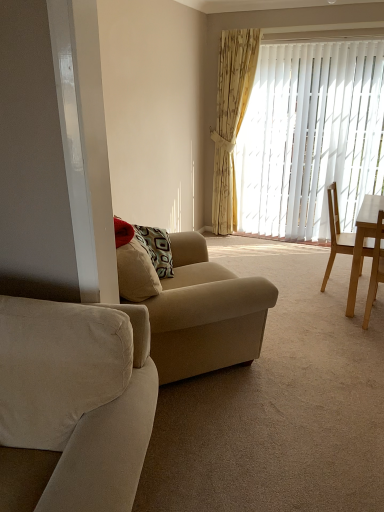
Question: From a real-world perspective, is beige fabric couch at center, placed as the 2th studio couch when sorted from front to back, located higher than yellow floral fabric curtain at upper right?

Choices:
 (A) no
 (B) yes

Answer: (A)

Question: Does beige fabric couch at center, acting as the first studio couch starting from the back, have a greater width compared to yellow floral fabric curtain at upper right?

Choices:
 (A) yes
 (B) no

Answer: (A)

Question: Considering the relative sizes of beige fabric couch at center, placed as the 2th studio couch when sorted from front to back, and yellow floral fabric curtain at upper right in the image provided, is beige fabric couch at center, placed as the 2th studio couch when sorted from front to back, thinner than yellow floral fabric curtain at upper right?

Choices:
 (A) no
 (B) yes

Answer: (A)

Question: Does beige fabric couch at center, placed as the 2th studio couch when sorted from front to back, appear on the left side of yellow floral fabric curtain at upper right?

Choices:
 (A) yes
 (B) no

Answer: (A)

Question: Is beige fabric couch at center, acting as the first studio couch starting from the back, positioned in front of yellow floral fabric curtain at upper right?

Choices:
 (A) yes
 (B) no

Answer: (A)

Question: Is beige fabric couch at center, acting as the first studio couch starting from the back, far from yellow floral fabric curtain at upper right?

Choices:
 (A) no
 (B) yes

Answer: (B)

Question: Can you confirm if suede beige couch at left, positioned as the 1th studio couch in front-to-back order, is positioned to the left of white vertical blinds at center?

Choices:
 (A) no
 (B) yes

Answer: (B)

Question: Could you tell me if suede beige couch at left, positioned as the 1th studio couch in front-to-back order, is turned towards white vertical blinds at center?

Choices:
 (A) no
 (B) yes

Answer: (A)

Question: Is the depth of suede beige couch at left, positioned as the 1th studio couch in front-to-back order, greater than that of white vertical blinds at center?

Choices:
 (A) no
 (B) yes

Answer: (A)

Question: From a real-world perspective, is suede beige couch at left, which is the 2th studio couch from back to front, located beneath white vertical blinds at center?

Choices:
 (A) yes
 (B) no

Answer: (A)

Question: Does suede beige couch at left, positioned as the 1th studio couch in front-to-back order, have a larger size compared to white vertical blinds at center?

Choices:
 (A) yes
 (B) no

Answer: (A)

Question: Can you confirm if suede beige couch at left, positioned as the 1th studio couch in front-to-back order, is shorter than white vertical blinds at center?

Choices:
 (A) no
 (B) yes

Answer: (B)

Question: Is light brown wooden chair at right, which is counted as the first chair, starting from the back, far away from beige fabric couch at center, acting as the first studio couch starting from the back?

Choices:
 (A) yes
 (B) no

Answer: (A)